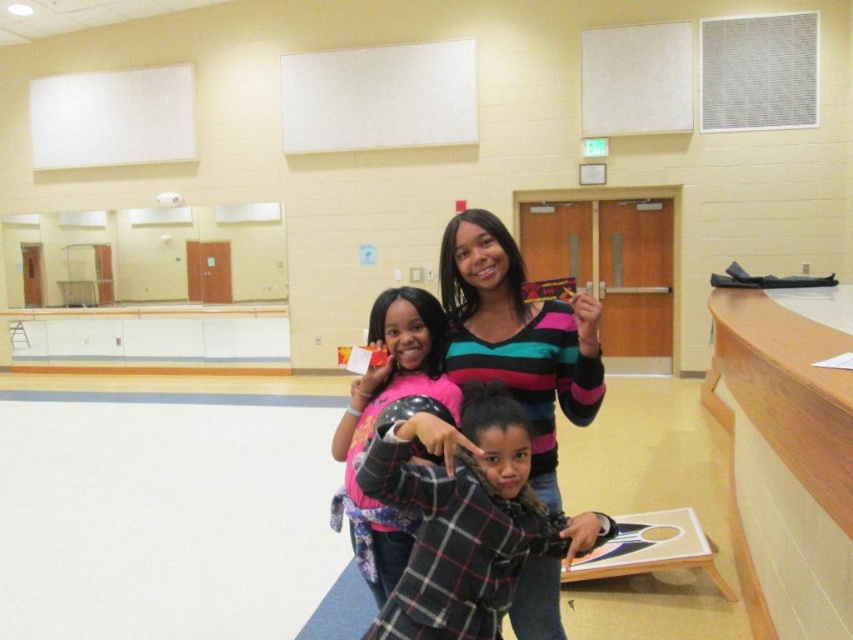
Question: Does plaid wool sweater at center lie in front of striped sweater at center?

Choices:
 (A) yes
 (B) no

Answer: (A)

Question: In this image, where is striped sweater at center located relative to pink fabric shirt at center?

Choices:
 (A) below
 (B) above

Answer: (B)

Question: Considering the real-world distances, which object is farthest from the plaid wool sweater at center?

Choices:
 (A) pink fabric shirt at center
 (B) striped sweater at center

Answer: (B)

Question: Which object appears closest to the camera in this image?

Choices:
 (A) pink fabric shirt at center
 (B) plaid wool sweater at center

Answer: (B)

Question: Which of the following is the closest to the observer?

Choices:
 (A) (401, 516)
 (B) (444, 442)

Answer: (B)

Question: Does plaid wool sweater at center have a greater width compared to pink fabric shirt at center?

Choices:
 (A) no
 (B) yes

Answer: (B)